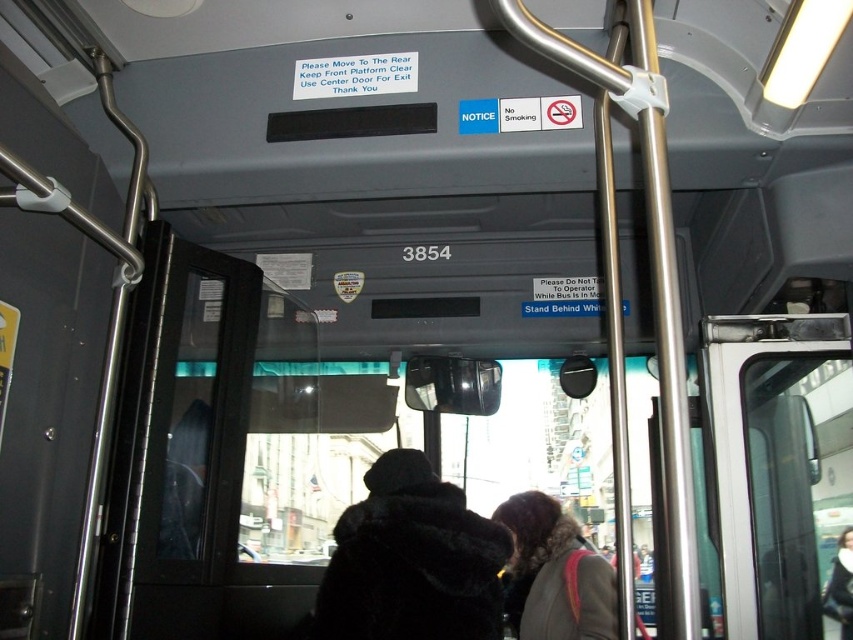
Question: Is black fur coat at center in front of dark brown fur coat at center?

Choices:
 (A) no
 (B) yes

Answer: (B)

Question: Which object appears farthest from the camera in this image?

Choices:
 (A) dark brown fur coat at center
 (B) black fur coat at center

Answer: (A)

Question: Is black fur coat at center in front of dark brown fur coat at center?

Choices:
 (A) no
 (B) yes

Answer: (B)

Question: Does black fur coat at center have a lesser width compared to dark brown fur coat at center?

Choices:
 (A) yes
 (B) no

Answer: (B)

Question: Which of the following is the farthest from the observer?

Choices:
 (A) (402, 632)
 (B) (535, 566)

Answer: (B)